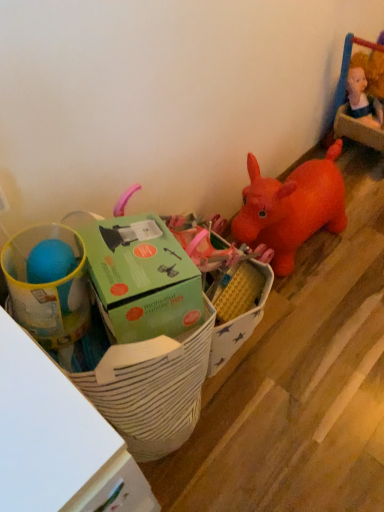
The width and height of the screenshot is (384, 512). In order to click on vacant region to the right of green cardboard box at center in this screenshot , I will do `click(321, 342)`.